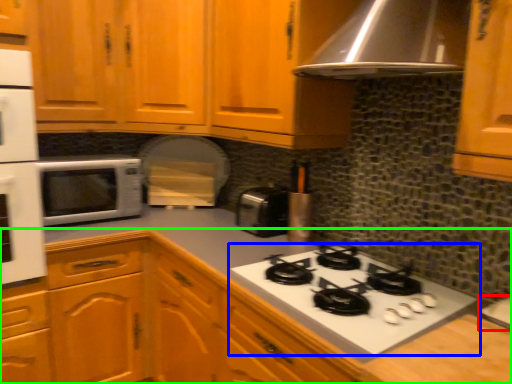
Question: Based on their relative distances, which object is nearer to sink (highlighted by a red box)? Choose from gas stove (highlighted by a blue box) and cabinetry (highlighted by a green box).

Choices:
 (A) gas stove
 (B) cabinetry

Answer: (A)